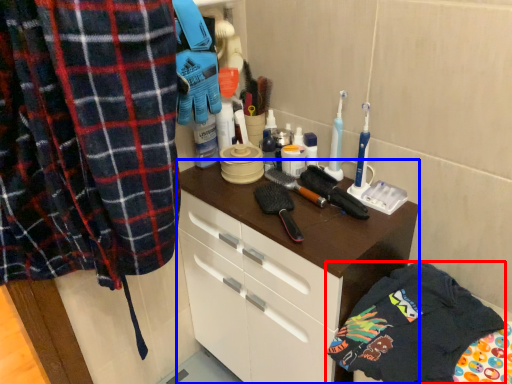
Question: Which object appears closest to the camera in this image, clothing (highlighted by a red box) or cabinetry (highlighted by a blue box)?

Choices:
 (A) clothing
 (B) cabinetry

Answer: (A)